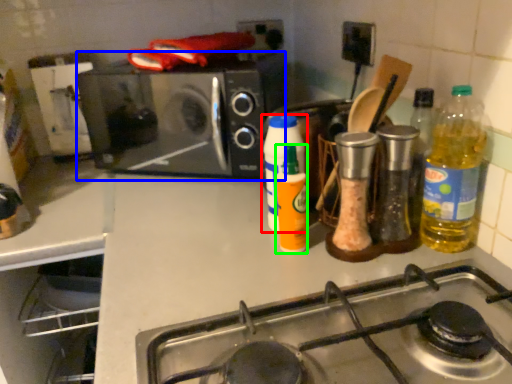
Question: Which object is the farthest from bottle (highlighted by a red box)? Choose among these: microwave oven (highlighted by a blue box) or bottle (highlighted by a green box).

Choices:
 (A) microwave oven
 (B) bottle

Answer: (A)